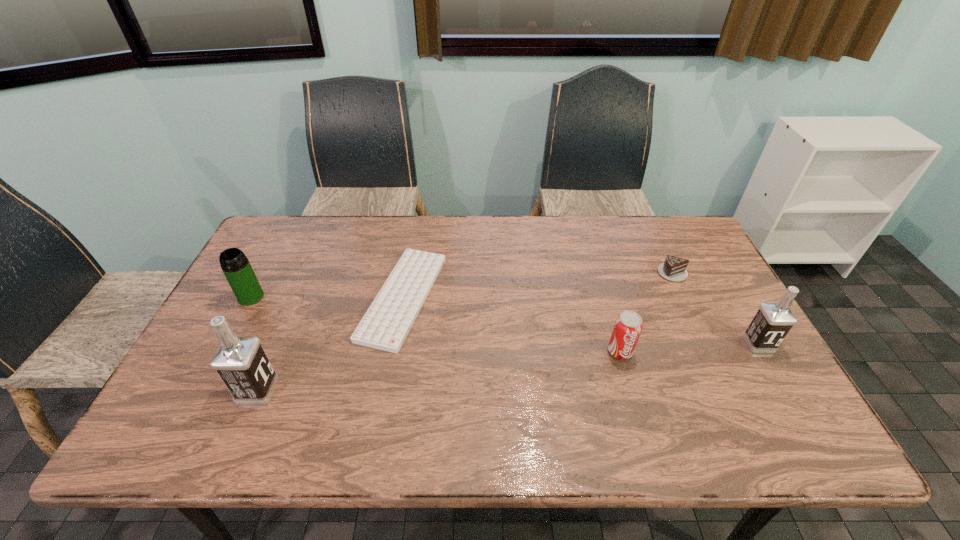
At what (x,y) coordinates should I click in order to perform the action: click on free point that satisfies the following two spatial constraints: 1. on the front label of the shorter vodka; 2. on the front label of the nearer vodka. Please return your answer as a coordinate pair (x, y). This screenshot has width=960, height=540. Looking at the image, I should click on (785, 390).

The width and height of the screenshot is (960, 540). Find the location of `free location that satisfies the following two spatial constraints: 1. from the spout of the thermos bottle; 2. on the right side of the fourth object from right to left`. free location that satisfies the following two spatial constraints: 1. from the spout of the thermos bottle; 2. on the right side of the fourth object from right to left is located at coordinates (251, 297).

Locate an element on the screen. free spot that satisfies the following two spatial constraints: 1. on the front label of the farther vodka; 2. on the front label of the nearer vodka is located at coordinates (785, 390).